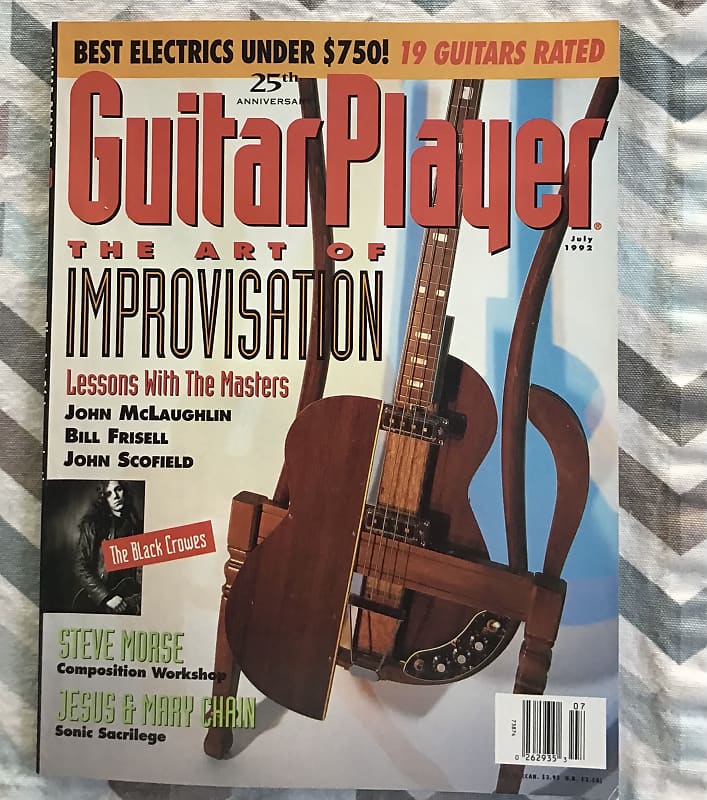
This screenshot has height=800, width=707. Find the location of `magazine`. magazine is located at coordinates (584, 353).